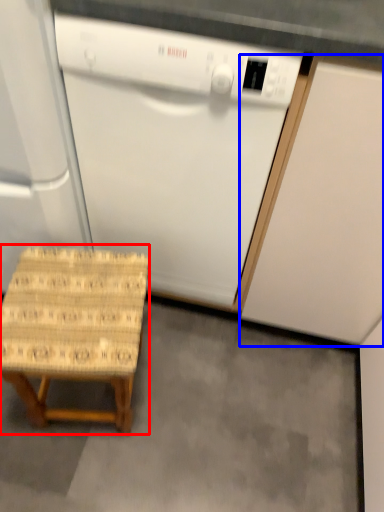
Question: Which object appears closest to the camera in this image, stool (highlighted by a red box) or cabinetry (highlighted by a blue box)?

Choices:
 (A) stool
 (B) cabinetry

Answer: (B)